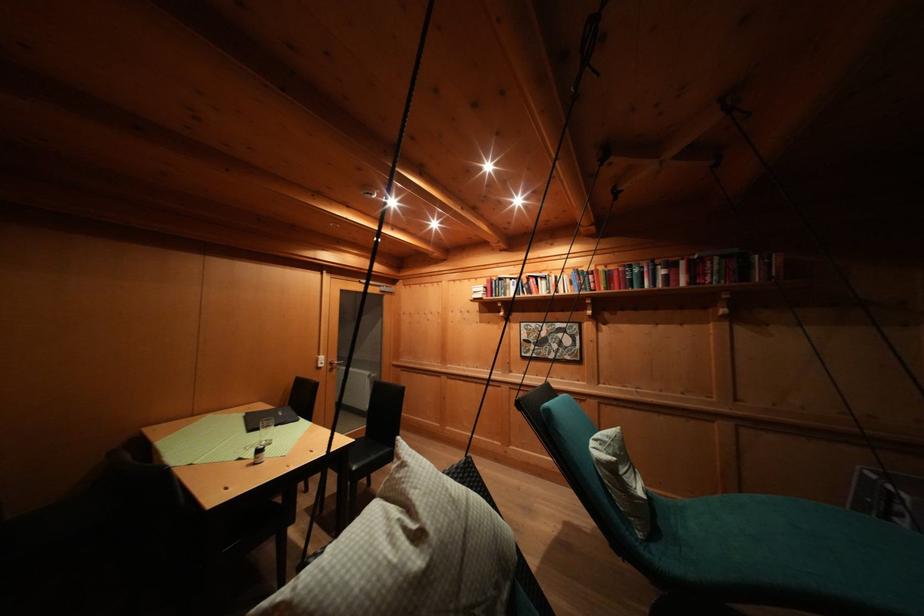
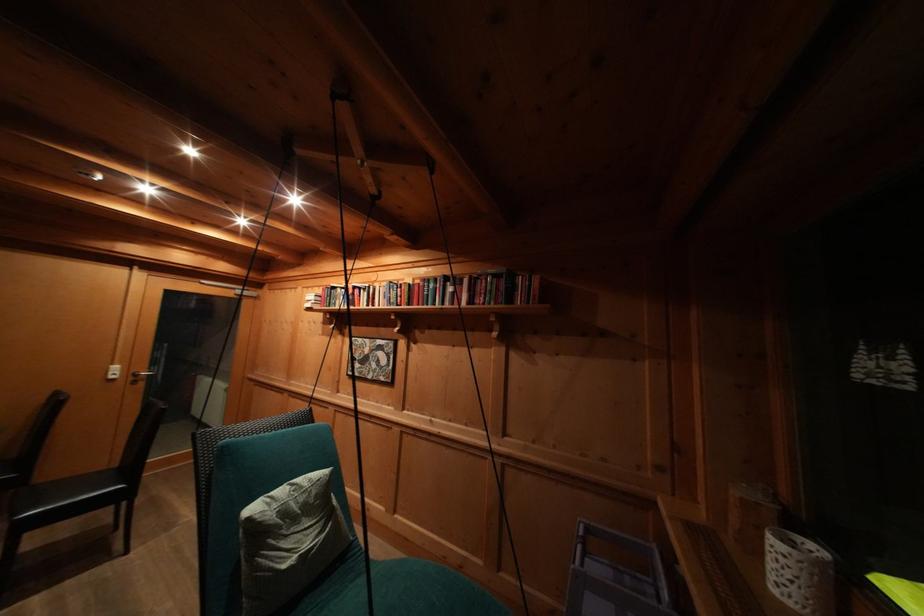
In the second image, find the point that corresponds to pixel 460 286 in the first image.

(313, 293)